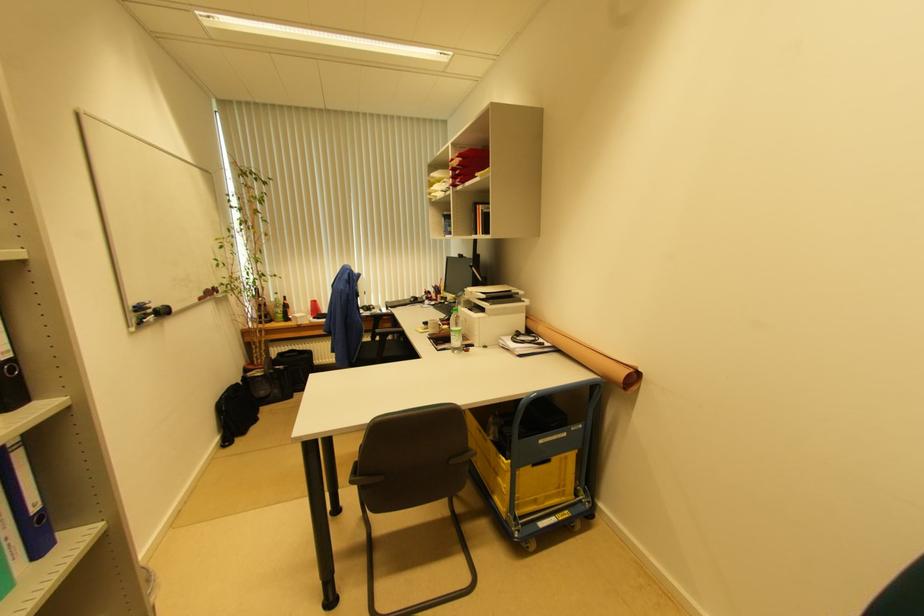
Find where to lift the black backpack. Please return your answer as a coordinate pair (x, y).

(235, 411)